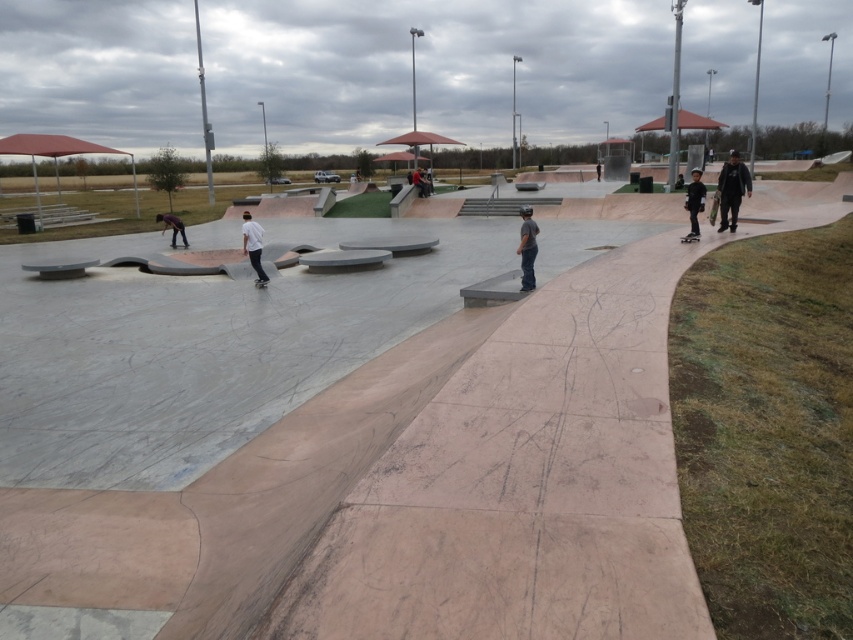
You are a photographer positioned at the entrance of the skatepark and want to capture both the dark gray jacket at upper right and the dark gray jeans at center in a single frame. Based on their positions, which object should you adjust your camera angle to focus on first to ensure both are in the shot?

The dark gray jacket at upper right is to the right of the dark gray jeans at center, so you should first focus on the dark gray jeans at center to ensure both are within the frame.